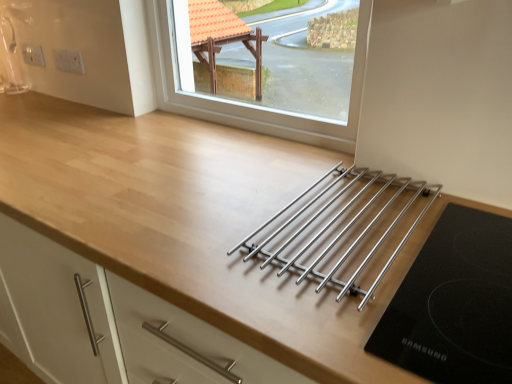
What do you see at coordinates (251, 106) in the screenshot? The height and width of the screenshot is (384, 512). I see `clear glass window at upper center` at bounding box center [251, 106].

This screenshot has height=384, width=512. I want to click on white plastic electric outlet at upper left, the first electric outlet in the right-to-left sequence, so click(63, 59).

Locate an element on the screen. white plastic electrical outlet at upper left, arranged as the second electric outlet when viewed from the right is located at coordinates (33, 55).

Considering the positions of points (32, 57) and (58, 54), is point (32, 57) closer to camera compared to point (58, 54)?

No, it is not.

Can you confirm if white plastic electrical outlet at upper left, arranged as the second electric outlet when viewed from the right, is thinner than white plastic electric outlet at upper left, the first electric outlet in the right-to-left sequence?

No.

Can you confirm if white plastic electrical outlet at upper left, the 2th electric outlet from the front, is bigger than white plastic electric outlet at upper left, placed as the first electric outlet when sorted from front to back?

Correct, white plastic electrical outlet at upper left, the 2th electric outlet from the front, is larger in size than white plastic electric outlet at upper left, placed as the first electric outlet when sorted from front to back.

From a real-world perspective, which is physically below, white plastic electrical outlet at upper left, arranged as the second electric outlet when viewed from the right, or white plastic electric outlet at upper left, placed as the first electric outlet when sorted from front to back?

In real-world perspective, white plastic electric outlet at upper left, placed as the first electric outlet when sorted from front to back, is lower.

Considering the relative sizes of polished stainless steel rack at center and white plastic electrical outlet at upper left, arranged as the first electric outlet when viewed from the left, in the image provided, is polished stainless steel rack at center taller than white plastic electrical outlet at upper left, arranged as the first electric outlet when viewed from the left,?

No.

Is point (244, 244) positioned behind point (28, 50)?

No, it is not.

Is polished stainless steel rack at center positioned with its back to white plastic electrical outlet at upper left, which is counted as the 1th electric outlet, starting from the back?

polished stainless steel rack at center does not have its back to white plastic electrical outlet at upper left, which is counted as the 1th electric outlet, starting from the back.

Can you confirm if white plastic electric outlet at upper left, the first electric outlet in the right-to-left sequence, is positioned to the right of clear glass window at upper center?

Incorrect, white plastic electric outlet at upper left, the first electric outlet in the right-to-left sequence, is not on the right side of clear glass window at upper center.

Which of these two, white plastic electric outlet at upper left, the first electric outlet in the right-to-left sequence, or clear glass window at upper center, is smaller?

With smaller size is white plastic electric outlet at upper left, the first electric outlet in the right-to-left sequence.

From the picture: Is white plastic electric outlet at upper left, the first electric outlet in the right-to-left sequence, next to clear glass window at upper center and touching it?

They are not placed beside each other.

Can you confirm if white plastic electric outlet at upper left, the first electric outlet in the right-to-left sequence, is taller than clear glass window at upper center?

In fact, white plastic electric outlet at upper left, the first electric outlet in the right-to-left sequence, may be shorter than clear glass window at upper center.

From the image's perspective, between clear glass window at upper center and white plastic electrical outlet at upper left, the 2th electric outlet from the front, which one is located above?

white plastic electrical outlet at upper left, the 2th electric outlet from the front.

Which object is wider, clear glass window at upper center or white plastic electrical outlet at upper left, arranged as the first electric outlet when viewed from the left?

With larger width is clear glass window at upper center.

Considering the sizes of objects clear glass window at upper center and white plastic electrical outlet at upper left, arranged as the first electric outlet when viewed from the left, in the image provided, who is bigger, clear glass window at upper center or white plastic electrical outlet at upper left, arranged as the first electric outlet when viewed from the left,?

clear glass window at upper center is bigger.

Does point (437, 190) appear closer or farther from the camera than point (69, 71)?

Point (437, 190) appears to be closer to the viewer than point (69, 71).

Who is more distant, polished stainless steel rack at center or white plastic electric outlet at upper left, placed as the first electric outlet when sorted from front to back?

white plastic electric outlet at upper left, placed as the first electric outlet when sorted from front to back, is more distant.

Is polished stainless steel rack at center oriented away from white plastic electric outlet at upper left, the second electric outlet in the back-to-front sequence?

No.

From the image's perspective, which is above, polished stainless steel rack at center or white plastic electric outlet at upper left, the first electric outlet in the right-to-left sequence?

white plastic electric outlet at upper left, the first electric outlet in the right-to-left sequence, appears higher in the image.

Is clear glass window at upper center not inside white plastic electric outlet at upper left, the second electric outlet in the back-to-front sequence?

Yes, clear glass window at upper center is located beyond the bounds of white plastic electric outlet at upper left, the second electric outlet in the back-to-front sequence.

Is clear glass window at upper center closer to camera compared to white plastic electric outlet at upper left, the second electric outlet viewed from the left?

Yes, clear glass window at upper center is closer to the camera.

Between clear glass window at upper center and white plastic electric outlet at upper left, the second electric outlet in the back-to-front sequence, which one has more height?

Standing taller between the two is clear glass window at upper center.

Is point (291, 138) farther from camera compared to point (57, 52)?

No, it is not.

Between clear glass window at upper center and polished stainless steel rack at center, which one appears on the right side from the viewer's perspective?

Positioned to the right is polished stainless steel rack at center.

Between clear glass window at upper center and polished stainless steel rack at center, which one has more height?

With more height is clear glass window at upper center.

Looking at their sizes, would you say clear glass window at upper center is wider or thinner than polished stainless steel rack at center?

In the image, clear glass window at upper center appears to be more narrow than polished stainless steel rack at center.

Is clear glass window at upper center not close to polished stainless steel rack at center?

No, clear glass window at upper center is in close proximity to polished stainless steel rack at center.

Identify the location of electric outlet lying in front of the white plastic electrical outlet at upper left, arranged as the second electric outlet when viewed from the right. [63, 59].

From the image's perspective, starting from the polished stainless steel rack at center, which electric outlet is the 2nd one above? Please provide its 2D coordinates.

[(33, 55)]

Estimate the real-world distances between objects in this image. Which object is closer to clear glass window at upper center, polished stainless steel rack at center or white plastic electric outlet at upper left, the second electric outlet viewed from the left?

polished stainless steel rack at center is closer to clear glass window at upper center.

Which object lies further to the anchor point polished stainless steel rack at center, white plastic electric outlet at upper left, the second electric outlet viewed from the left, or white plastic electrical outlet at upper left, arranged as the first electric outlet when viewed from the left?

white plastic electrical outlet at upper left, arranged as the first electric outlet when viewed from the left, lies further to polished stainless steel rack at center than the other object.

From the image, which object appears to be nearer to clear glass window at upper center, white plastic electric outlet at upper left, placed as the first electric outlet when sorted from front to back, or polished stainless steel rack at center?

polished stainless steel rack at center is positioned closer to the anchor clear glass window at upper center.

From the image, which object appears to be nearer to clear glass window at upper center, white plastic electrical outlet at upper left, the 2th electric outlet from the front, or polished stainless steel rack at center?

Based on the image, polished stainless steel rack at center appears to be nearer to clear glass window at upper center.

Considering their positions, is white plastic electrical outlet at upper left, the 2th electric outlet from the front, positioned closer to polished stainless steel rack at center than white plastic electric outlet at upper left, the second electric outlet in the back-to-front sequence?

white plastic electric outlet at upper left, the second electric outlet in the back-to-front sequence, is closer to polished stainless steel rack at center.

In the scene shown: Looking at the image, which one is located closer to white plastic electrical outlet at upper left, which is counted as the 1th electric outlet, starting from the back, white plastic electric outlet at upper left, the first electric outlet in the right-to-left sequence, or polished stainless steel rack at center?

white plastic electric outlet at upper left, the first electric outlet in the right-to-left sequence.

Based on their spatial positions, is clear glass window at upper center or white plastic electrical outlet at upper left, the 2th electric outlet from the front, closer to white plastic electric outlet at upper left, placed as the first electric outlet when sorted from front to back?

white plastic electrical outlet at upper left, the 2th electric outlet from the front, lies closer to white plastic electric outlet at upper left, placed as the first electric outlet when sorted from front to back, than the other object.

When comparing their distances from polished stainless steel rack at center, does clear glass window at upper center or white plastic electrical outlet at upper left, the 2th electric outlet from the front, seem closer?

clear glass window at upper center.

Where is `electric outlet situated between white plastic electrical outlet at upper left, which is counted as the 1th electric outlet, starting from the back, and clear glass window at upper center from left to right`? electric outlet situated between white plastic electrical outlet at upper left, which is counted as the 1th electric outlet, starting from the back, and clear glass window at upper center from left to right is located at coordinates (63, 59).

The image size is (512, 384). Find the location of `electric outlet situated between white plastic electrical outlet at upper left, arranged as the first electric outlet when viewed from the left, and polished stainless steel rack at center from left to right`. electric outlet situated between white plastic electrical outlet at upper left, arranged as the first electric outlet when viewed from the left, and polished stainless steel rack at center from left to right is located at coordinates (63, 59).

Find the location of a particular element. window between white plastic electric outlet at upper left, placed as the first electric outlet when sorted from front to back, and polished stainless steel rack at center from left to right is located at coordinates (251, 106).

Image resolution: width=512 pixels, height=384 pixels. What are the coordinates of `window between white plastic electrical outlet at upper left, which is counted as the 1th electric outlet, starting from the back, and polished stainless steel rack at center, in the horizontal direction` in the screenshot? It's located at (251, 106).